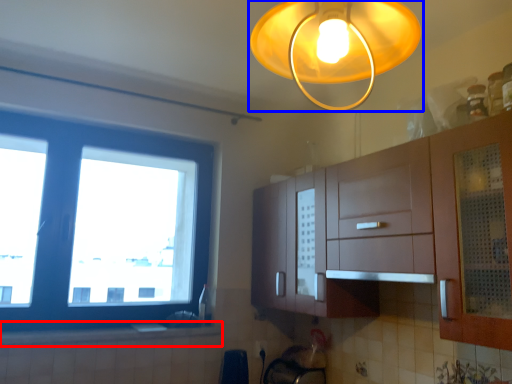
Question: Which point is further to the camera, counter top (highlighted by a red box) or lamp (highlighted by a blue box)?

Choices:
 (A) counter top
 (B) lamp

Answer: (A)